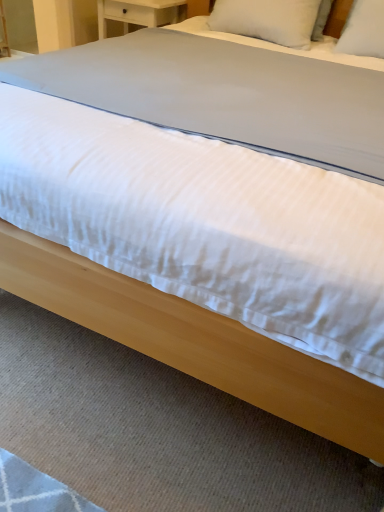
Question: Should I look upward or downward to see white soft pillow at upper center?

Choices:
 (A) down
 (B) up

Answer: (B)